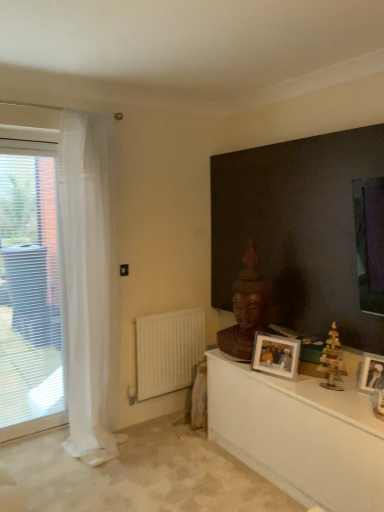
What are the coordinates of `free location in front of white sheer curtain at left` in the screenshot? It's located at (96, 481).